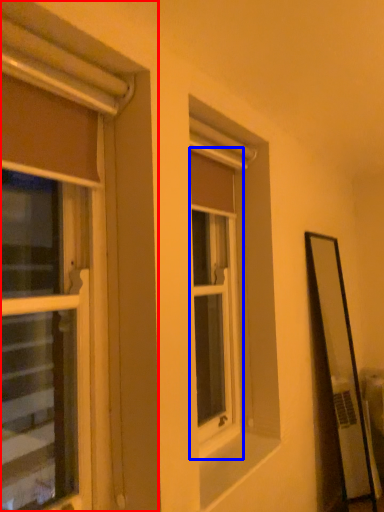
Question: Which of the following is the farthest to the observer, window (highlighted by a red box) or window (highlighted by a blue box)?

Choices:
 (A) window
 (B) window

Answer: (B)